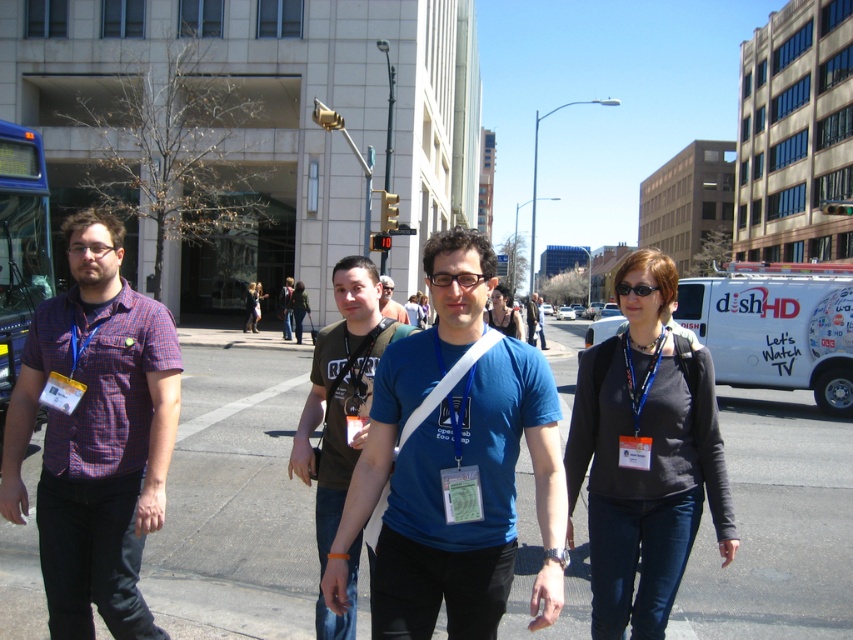
Question: Which of the following is the farthest from the observer?

Choices:
 (A) (251, 296)
 (B) (529, 310)
 (C) (322, 403)
 (D) (357, 500)

Answer: (A)

Question: Which object appears farthest from the camera in this image?

Choices:
 (A) matte brown shirt at center
 (B) blue cotton t-shirt at center

Answer: (A)

Question: Does matte brown t-shirt at center appear on the right side of brown fabric backpack at center?

Choices:
 (A) no
 (B) yes

Answer: (B)

Question: Which of the following is the farthest from the observer?

Choices:
 (A) gray asphalt pavement at center
 (B) matte brown shirt at center
 (C) matte blue shirt at center
 (D) matte brown t-shirt at center

Answer: (C)

Question: Does matte blue t-shirt at center appear over brown cotton t-shirt at center?

Choices:
 (A) yes
 (B) no

Answer: (B)

Question: Does blue cotton t-shirt at center come behind brown cotton t-shirt at center?

Choices:
 (A) no
 (B) yes

Answer: (A)